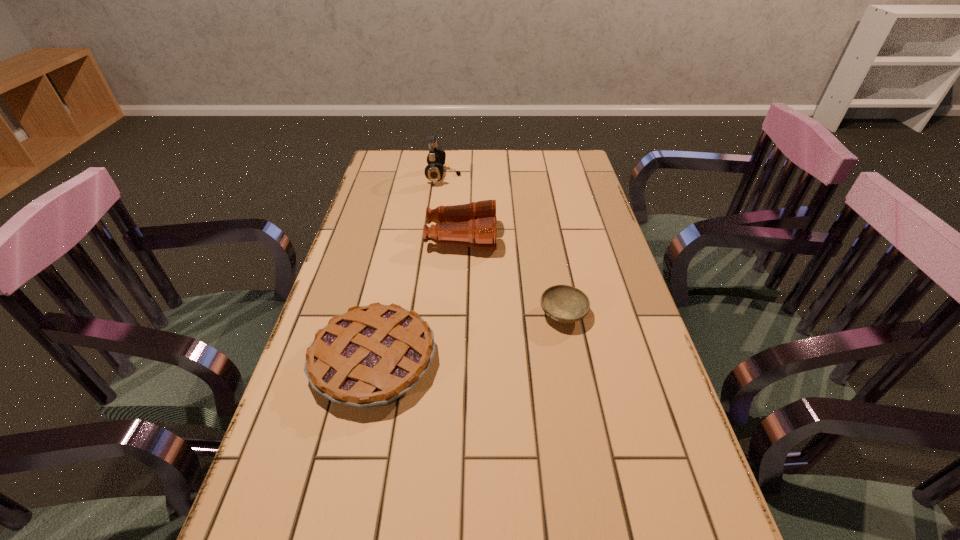
The width and height of the screenshot is (960, 540). Find the location of `free space located 0.050m on the back of the rightmost object`. free space located 0.050m on the back of the rightmost object is located at coordinates (558, 284).

You are a GUI agent. You are given a task and a screenshot of the screen. Output one action in this format:
    pyautogui.click(x=<x>, y=<y>)
    Task: Click on the object present at the far edge
    This screenshot has height=540, width=960.
    Given the screenshot: What is the action you would take?
    pyautogui.click(x=434, y=171)

Locate an element on the screen. The height and width of the screenshot is (540, 960). object positioned at the left edge is located at coordinates [370, 356].

This screenshot has height=540, width=960. Find the location of `object present at the right edge`. object present at the right edge is located at coordinates (563, 303).

Identify the location of free region at the far edge of the desktop. This screenshot has height=540, width=960. (487, 153).

In the image, there is a desktop. Where is `vacant space at the left edge`? vacant space at the left edge is located at coordinates (412, 184).

At what (x,y) coordinates should I click in order to perform the action: click on vacant space at the right edge of the desktop. Please return your answer as a coordinate pair (x, y). The width and height of the screenshot is (960, 540). Looking at the image, I should click on (666, 517).

What are the coordinates of `vacant space at the far left corner of the desktop` in the screenshot? It's located at (381, 153).

This screenshot has width=960, height=540. In the image, there is a desktop. What are the coordinates of `vacant space at the far right corner` in the screenshot? It's located at (575, 161).

Find the location of a particular element. vacant point located between the farthest object and the shortest object is located at coordinates [503, 246].